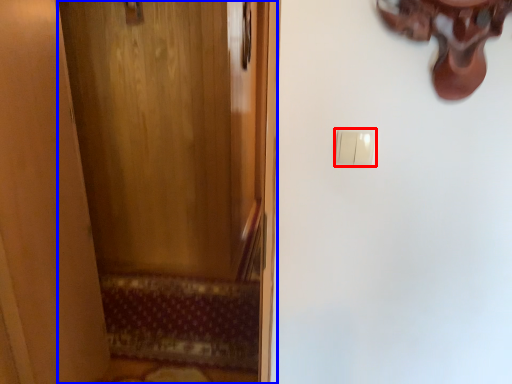
Question: Which object is further to the camera taking this photo, light switch (highlighted by a red box) or door (highlighted by a blue box)?

Choices:
 (A) light switch
 (B) door

Answer: (A)